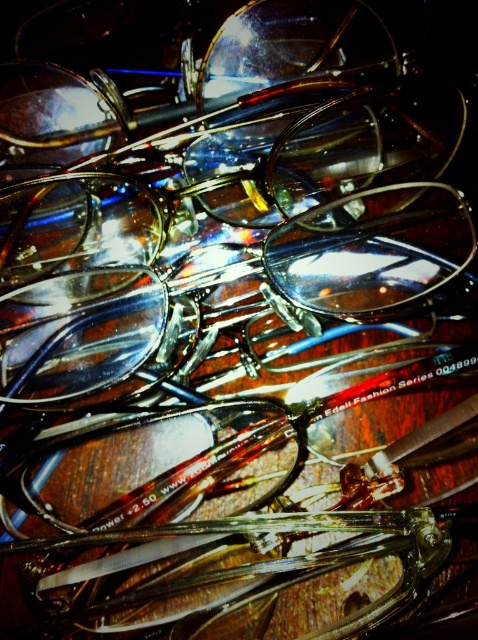
You are organizing a display of glasses and need to place a new pair between the shiny brown glasses at center and the shiny metallic glasses at center. Where should you place it to maintain the current arrangement?

The shiny brown glasses at center is positioned on the left side of the shiny metallic glasses at center, so placing the new pair between them would mean putting it to the right of the shiny brown glasses at center and to the left of the shiny metallic glasses at center.

Based on the photo, you are looking at a collection of eyeglasses on a wooden surface. There are two points of interest marked as point 1 and point 2. Point 1 is at coordinate (133, 253) and point 2 is at coordinate (29, 330). Which point is closer to you?

Point 1 is closer to you because it is further to the viewer than point 2.

You are an optometrist organizing a display of glasses. You need to place a new pair of glasses exactly at the center of the wooden surface. The shiny brown glasses at center are currently occupying a specific spot. Where should you place the new glasses to ensure they are centered?

The shiny brown glasses at center are located at point (227, 179), so you should place the new glasses at the center coordinates of the wooden surface, which would be different from the current position of the shiny brown glasses at center.